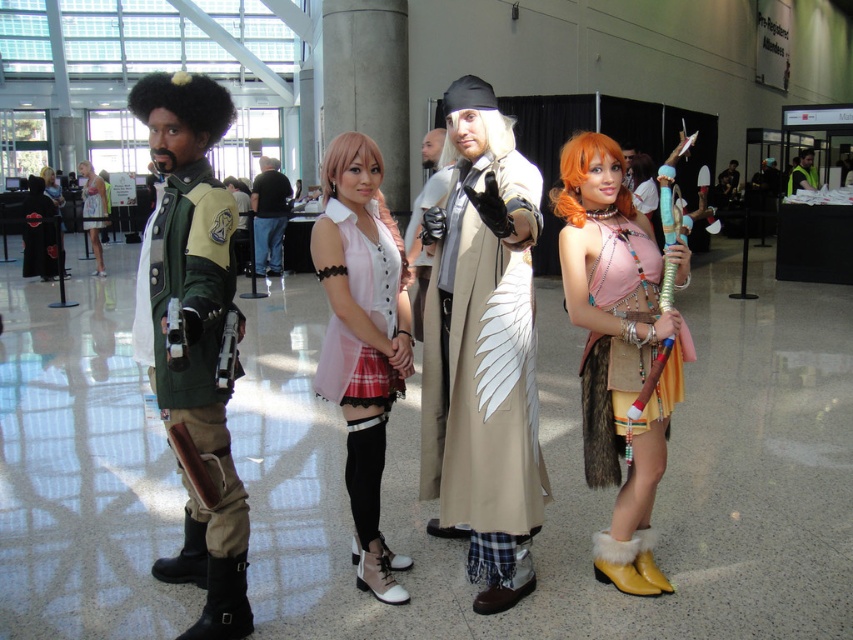
Question: Can you confirm if pink fabric dress at center is smaller than black leather jacket at center?

Choices:
 (A) yes
 (B) no

Answer: (A)

Question: Estimate the real-world distances between objects in this image. Which object is closer to the matte pink dress at center?

Choices:
 (A) pink fabric skirt at center
 (B) matte black jacket at center
 (C) green fabric jacket at left
 (D) tan leather coat at center

Answer: (B)

Question: Where is pink fabric dress at center located in relation to matte black jacket at center in the image?

Choices:
 (A) left
 (B) right

Answer: (B)

Question: Is tan leather coat at center in front of brushed metal gun at center?

Choices:
 (A) yes
 (B) no

Answer: (A)

Question: Estimate the real-world distances between objects in this image. Which object is closer to the black leather jacket at center?

Choices:
 (A) leather fringe skirt at center
 (B) green fabric jacket at left
 (C) matte black jacket at center

Answer: (C)

Question: Based on their relative distances, which object is nearer to the matte black jacket at center?

Choices:
 (A) pink fabric skirt at center
 (B) green fabric jacket at left
 (C) matte pink dress at center
 (D) brushed metal gun at center

Answer: (D)